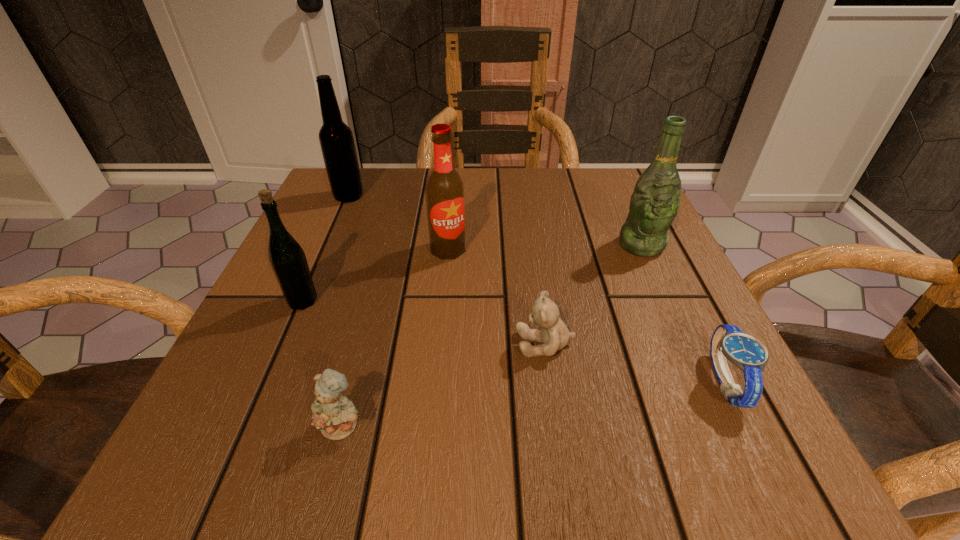
You are a GUI agent. You are given a task and a screenshot of the screen. Output one action in this format:
    pyautogui.click(x=<x>, y=<y>)
    Task: Click on the free space between the watch and the farthest beer bottle
    Image resolution: width=960 pixels, height=540 pixels.
    Given the screenshot: What is the action you would take?
    pyautogui.click(x=537, y=289)

At what (x,y) coordinates should I click in order to perform the action: click on object that is the closest to the farthest beer bottle. Please return your answer as a coordinate pair (x, y). This screenshot has width=960, height=540. Looking at the image, I should click on (444, 191).

You are a GUI agent. You are given a task and a screenshot of the screen. Output one action in this format:
    pyautogui.click(x=<x>, y=<y>)
    Task: Click on the object that can be found as the fifth closest to the farther teddy bear
    The image size is (960, 540).
    Given the screenshot: What is the action you would take?
    (287, 258)

Point out which beer bottle is positioned as the fourth nearest to the farther teddy bear. Please provide its 2D coordinates. Your answer should be formatted as a tuple, i.e. [(x, y)], where the tuple contains the x and y coordinates of a point satisfying the conditions above.

[(337, 144)]

Identify which beer bottle is the second closest to the fourth object from right to left. Please provide its 2D coordinates. Your answer should be formatted as a tuple, i.e. [(x, y)], where the tuple contains the x and y coordinates of a point satisfying the conditions above.

[(337, 144)]

The image size is (960, 540). I want to click on free location that satisfies the following two spatial constraints: 1. on the surface of the rightmost beer bottle; 2. on the left side of the shortest object, so pyautogui.click(x=704, y=382).

Locate an element on the screen. This screenshot has width=960, height=540. vacant space that satisfies the following two spatial constraints: 1. on the face of the farther teddy bear; 2. on the front-facing side of the third object from left to right is located at coordinates (558, 427).

Where is `vacant position in the image that satisfies the following two spatial constraints: 1. on the face of the fifth object from left to right; 2. on the front-facing side of the third object from left to right`? The height and width of the screenshot is (540, 960). vacant position in the image that satisfies the following two spatial constraints: 1. on the face of the fifth object from left to right; 2. on the front-facing side of the third object from left to right is located at coordinates point(558,427).

At what (x,y) coordinates should I click in order to perform the action: click on vacant space that satisfies the following two spatial constraints: 1. on the front side of the third beer bottle from left to right; 2. on the left side of the farthest beer bottle. Please return your answer as a coordinate pair (x, y). The width and height of the screenshot is (960, 540). Looking at the image, I should click on (325, 249).

You are a GUI agent. You are given a task and a screenshot of the screen. Output one action in this format:
    pyautogui.click(x=<x>, y=<y>)
    Task: Click on the free location that satisfies the following two spatial constraints: 1. on the face of the right teddy bear; 2. on the right side of the watch
    The width and height of the screenshot is (960, 540).
    Given the screenshot: What is the action you would take?
    pyautogui.click(x=551, y=382)